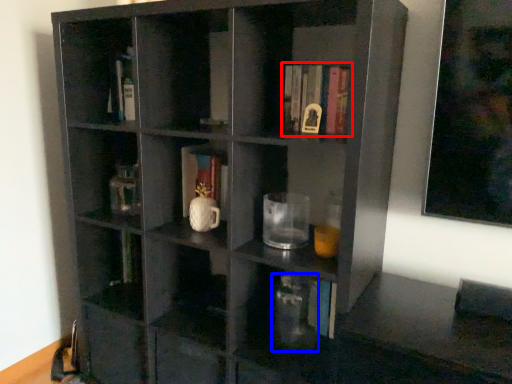
Question: Among these objects, which one is nearest to the camera, book (highlighted by a red box) or glass vase (highlighted by a blue box)?

Choices:
 (A) book
 (B) glass vase

Answer: (A)